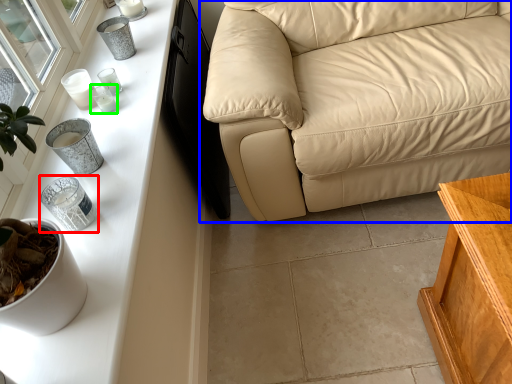
Question: Which is farther away from candle holder (highlighted by a red box)? studio couch (highlighted by a blue box) or candle holder (highlighted by a green box)?

Choices:
 (A) studio couch
 (B) candle holder

Answer: (A)